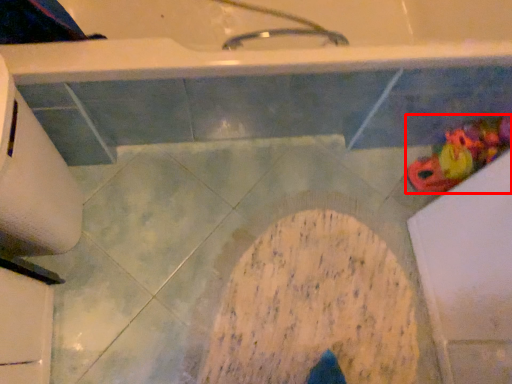
Question: In this image, where is toy (annotated by the red box) located relative to toilet paper?

Choices:
 (A) left
 (B) right

Answer: (B)